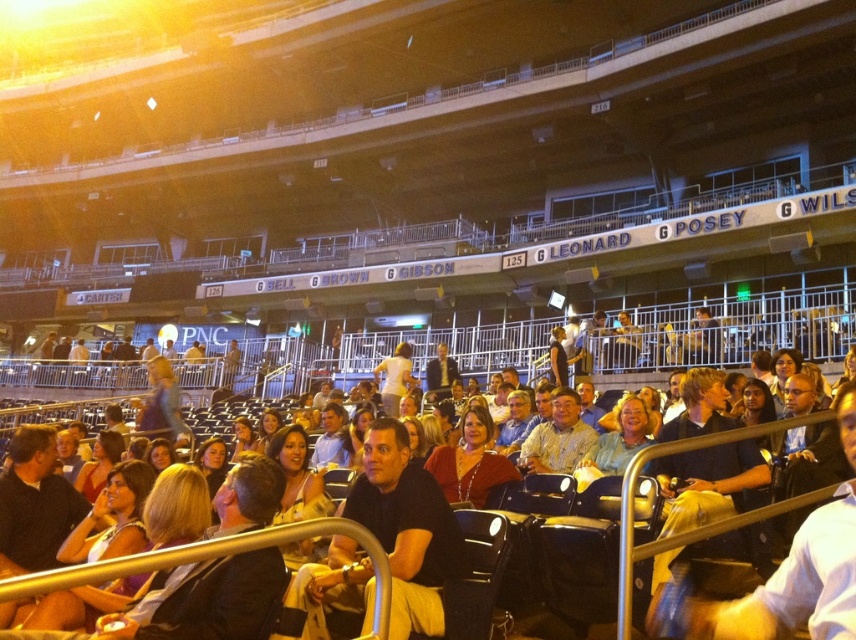
Can you confirm if light brown wood chair at center is shorter than matte black shirt at center?

No, light brown wood chair at center is not shorter than matte black shirt at center.

Is light brown wood chair at center to the left of matte black shirt at center from the viewer's perspective?

In fact, light brown wood chair at center is to the right of matte black shirt at center.

Image resolution: width=856 pixels, height=640 pixels. Identify the location of light brown wood chair at center. (557, 436).

Does matte red sweater at center appear on the right side of light brown hair at center?

Correct, you'll find matte red sweater at center to the right of light brown hair at center.

Is matte red sweater at center positioned at the back of light brown hair at center?

No.

Is point (449, 460) positioned in front of point (333, 417)?

Yes, it is in front of point (333, 417).

Find the location of `matte red sweater at center`. matte red sweater at center is located at coordinates (470, 461).

Does dark blue shirt at center lie in front of light brown wood chair at center?

Yes, dark blue shirt at center is closer to the viewer.

Is dark blue shirt at center below light brown wood chair at center?

Yes, dark blue shirt at center is below light brown wood chair at center.

Between point (414, 572) and point (575, 419), which one is positioned behind?

The point (575, 419) is more distant.

Find the location of a particular element. This screenshot has width=856, height=640. dark blue shirt at center is located at coordinates (406, 528).